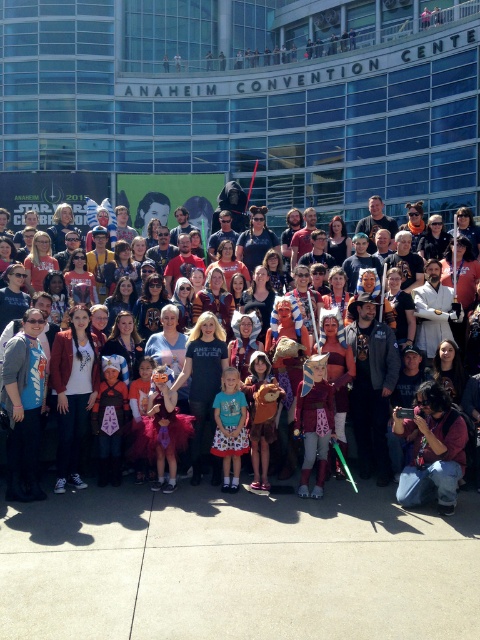
You are a photographer at the Anaheim Convention Center. You want to take a photo of the matte blue shirt at center without the multicolored costumes at center blocking it. Is this possible given their positions?

The multicolored costumes at center is in front of matte blue shirt at center, so it will block the view. To capture the matte blue shirt at center without obstruction, you would need to move the multicolored costumes at center out of the way or adjust your angle to avoid them.

You are at the Anaheim Convention Center and see a crowd of people in costumes. There is a multicolored costumes at center and a matte pink dress at center. Which one is positioned to the left?

The multicolored costumes at center are positioned to the left of the matte pink dress at center.

You are a photographer standing behind the group at the Anaheim Convention Center. You want to take a photo that includes both the matte pink dress at center and the matte blue shirt at center. If your camera has a maximum focus range of 30 inches, will you be able to capture both subjects clearly in the same frame?

The distance between the matte pink dress at center and the matte blue shirt at center is 31.71 inches, which exceeds the camera focus range of 30 inches. Therefore, you cannot capture both subjects clearly in the same frame.